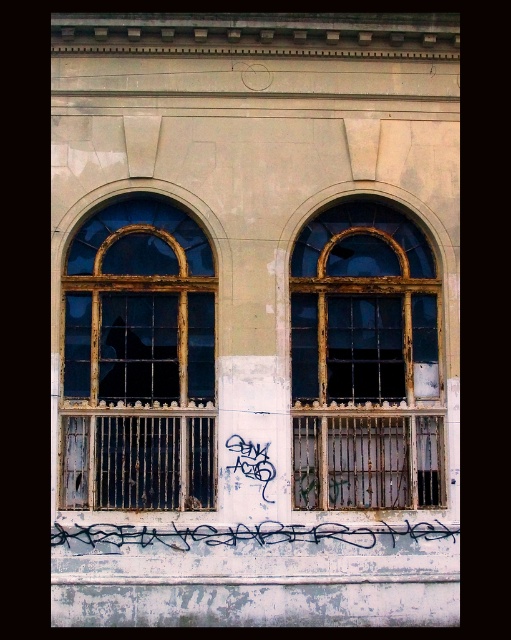
Can you confirm if rusty metal window at center is smaller than black graffiti at center?

Incorrect, rusty metal window at center is not smaller in size than black graffiti at center.

Is rusty metal window at center closer to camera compared to black graffiti at center?

That is False.

Does point (384, 355) come in front of point (187, 529)?

No, it is not.

Image resolution: width=511 pixels, height=640 pixels. Find the location of `rusty metal window at center`. rusty metal window at center is located at coordinates (364, 362).

Who is more forward, (62,416) or (408,227)?

Point (62,416) is more forward.

Does rusty metal window at left have a lesser width compared to rusty metal window at center?

Incorrect, rusty metal window at left's width is not less than rusty metal window at center's.

The height and width of the screenshot is (640, 511). I want to click on rusty metal window at left, so click(138, 360).

Does rusty metal window at left appear over black graffiti at center?

Yes, rusty metal window at left is above black graffiti at center.

Which is below, rusty metal window at left or black graffiti at center?

black graffiti at center is lower down.

Between point (158, 275) and point (343, 531), which one is positioned behind?

The point (158, 275) is more distant.

Where is `rusty metal window at left`? The image size is (511, 640). rusty metal window at left is located at coordinates (138, 360).